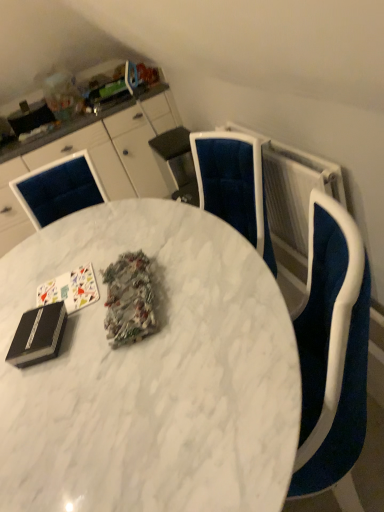
The height and width of the screenshot is (512, 384). What do you see at coordinates (129, 300) in the screenshot? I see `shiny metallic foil at center` at bounding box center [129, 300].

Find the location of a particular element. The image size is (384, 512). black matte binder at lower left is located at coordinates (38, 335).

Considering the points (115, 298) and (1, 204), which point is in front, point (115, 298) or point (1, 204)?

The point (115, 298) is more forward.

Is shiny metallic foil at center placed right next to white glossy cabinets at upper left?

No, shiny metallic foil at center is not touching white glossy cabinets at upper left.

Does shiny metallic foil at center have a lesser width compared to white glossy cabinets at upper left?

Indeed, shiny metallic foil at center has a lesser width compared to white glossy cabinets at upper left.

Between shiny metallic foil at center and white glossy cabinets at upper left, which one has smaller size?

Smaller between the two is shiny metallic foil at center.

From a real-world perspective, is black matte binder at lower left located higher than shiny metallic foil at center?

No, from a real-world perspective, black matte binder at lower left is not over shiny metallic foil at center

Is black matte binder at lower left facing towards shiny metallic foil at center?

No, black matte binder at lower left is not aimed at shiny metallic foil at center.

Between black matte binder at lower left and shiny metallic foil at center, which one is positioned in front?

shiny metallic foil at center.

Which is more to the right, black matte binder at lower left or shiny metallic foil at center?

shiny metallic foil at center is more to the right.

Is white matte card game at upper left oriented towards shiny metallic foil at center?

No, white matte card game at upper left is not oriented towards shiny metallic foil at center.

Is shiny metallic foil at center located within white matte card game at upper left?

Actually, shiny metallic foil at center is outside white matte card game at upper left.

Based on the photo, which object is thinner, white matte card game at upper left or shiny metallic foil at center?

white matte card game at upper left.

This screenshot has height=512, width=384. Identify the location of binder to the left of white matte card game at upper left. (38, 335).

Is white matte card game at upper left bigger than black matte binder at lower left?

Actually, white matte card game at upper left might be smaller than black matte binder at lower left.

Would you say white matte card game at upper left is inside or outside black matte binder at lower left?

white matte card game at upper left is spatially situated outside black matte binder at lower left.

How many degrees apart are the facing directions of white matte card game at upper left and black matte binder at lower left?

16.1 degrees separate the facing orientations of white matte card game at upper left and black matte binder at lower left.

Could you tell me if shiny metallic foil at center is facing black matte binder at lower left?

No, shiny metallic foil at center is not turned towards black matte binder at lower left.

Between point (140, 263) and point (36, 362), which one is positioned in front?

Positioned in front is point (36, 362).

Does point (65, 344) come in front of point (135, 272)?

Yes, point (65, 344) is in front of point (135, 272).

From a real-world perspective, is white marble table at center on shiny metallic foil at center?

No, from a real-world perspective, white marble table at center is not above shiny metallic foil at center.

Considering the relative sizes of white marble table at center and shiny metallic foil at center in the image provided, is white marble table at center bigger than shiny metallic foil at center?

Yes, white marble table at center is bigger than shiny metallic foil at center.

From the picture: How many degrees apart are the facing directions of white marble table at center and shiny metallic foil at center?

The angular difference between white marble table at center and shiny metallic foil at center is 12.8 degrees.

You are a GUI agent. You are given a task and a screenshot of the screen. Output one action in this format:
    pyautogui.click(x=<x>, y=<y>)
    Task: Click on the radiator directly beneath the white matte card game at upper left (from a real-world perspective)
    The width and height of the screenshot is (384, 512).
    Given the screenshot: What is the action you would take?
    pyautogui.click(x=293, y=190)

From the image's perspective, which is below, white matte card game at upper left or white textured radiator at upper right?

white matte card game at upper left is shown below in the image.

Based on the photo, from a real-world perspective, is white matte card game at upper left positioned under white textured radiator at upper right based on gravity?

No, from a real-world perspective, white matte card game at upper left is not under white textured radiator at upper right.

Is white matte card game at upper left next to white textured radiator at upper right and touching it?

No, white matte card game at upper left is not with white textured radiator at upper right.

Find the location of a particular element. cabinetry above the shiny metallic foil at center (from the image's perspective) is located at coordinates (101, 158).

This screenshot has width=384, height=512. I want to click on debris above the black matte binder at lower left (from a real-world perspective), so click(x=129, y=300).

Looking at this image, looking at the image, which one is located closer to black matte binder at lower left, white marble table at center or shiny metallic foil at center?

The object closer to black matte binder at lower left is shiny metallic foil at center.

When comparing their distances from black matte binder at lower left, does white textured radiator at upper right or white glossy cabinets at upper left seem further?

white glossy cabinets at upper left is further to black matte binder at lower left.

Estimate the real-world distances between objects in this image. Which object is further from white marble table at center, shiny metallic foil at center or white glossy cabinets at upper left?

white glossy cabinets at upper left.

From the image, which object appears to be nearer to shiny metallic foil at center, white matte card game at upper left or white textured radiator at upper right?

Among the two, white matte card game at upper left is located nearer to shiny metallic foil at center.

Considering their positions, is white textured radiator at upper right positioned closer to white matte card game at upper left than shiny metallic foil at center?

Based on the image, shiny metallic foil at center appears to be nearer to white matte card game at upper left.

Estimate the real-world distances between objects in this image. Which object is further from white matte card game at upper left, shiny metallic foil at center or white marble table at center?

The object further to white matte card game at upper left is white marble table at center.

Looking at the image, which one is located closer to white marble table at center, white textured radiator at upper right or black matte binder at lower left?

black matte binder at lower left lies closer to white marble table at center than the other object.

Looking at the image, which one is located closer to black matte binder at lower left, white matte card game at upper left or shiny metallic foil at center?

white matte card game at upper left is closer to black matte binder at lower left.

Identify the location of radiator positioned between white matte card game at upper left and white glossy cabinets at upper left from near to far. (293, 190).

This screenshot has height=512, width=384. I want to click on radiator positioned between black matte binder at lower left and white glossy cabinets at upper left from near to far, so click(x=293, y=190).

Where is `card game located between black matte binder at lower left and white glossy cabinets at upper left in the depth direction`? card game located between black matte binder at lower left and white glossy cabinets at upper left in the depth direction is located at coordinates (70, 289).

Locate an element on the screen. This screenshot has height=512, width=384. binder positioned between shiny metallic foil at center and white glossy cabinets at upper left from near to far is located at coordinates (38, 335).